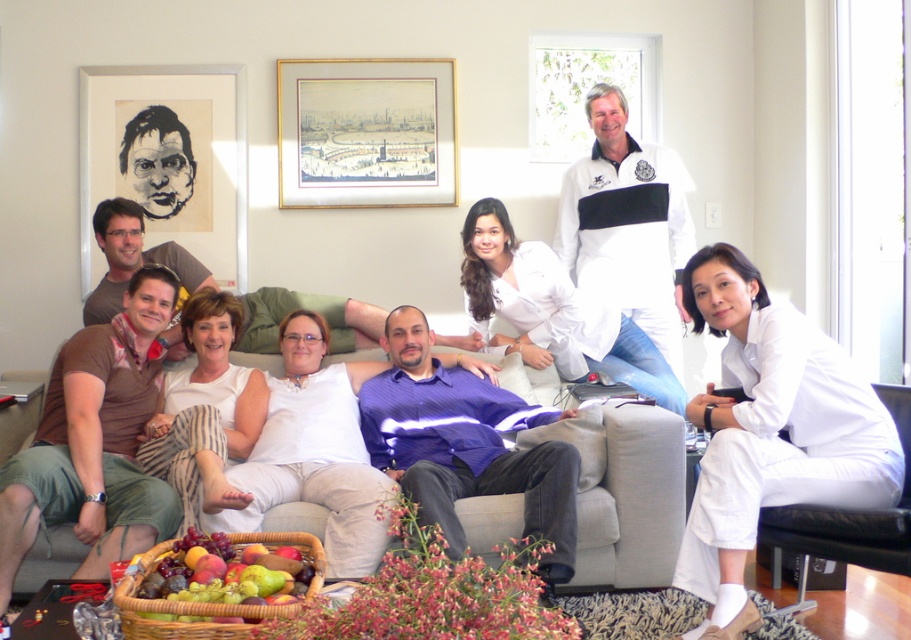
You are a photographer positioned at the entrance of the living room. You want to take a photo that includes both the purple striped shirt at center and the gray fabric couch at center. Which object will appear larger in the photo?

The purple striped shirt at center will appear larger in the photo because it is closer to the viewer than the gray fabric couch at center.

Based on the photo, you are a photographer setting up for a group photo in this living room. You want to ensure that the white cotton pants at center and the black paper portrait at upper left are both visible in the frame. Based on their positions, which object is closer to the camera?

The white cotton pants at center is located below the black paper portrait at upper left, which means it is closer to the camera than the portrait.